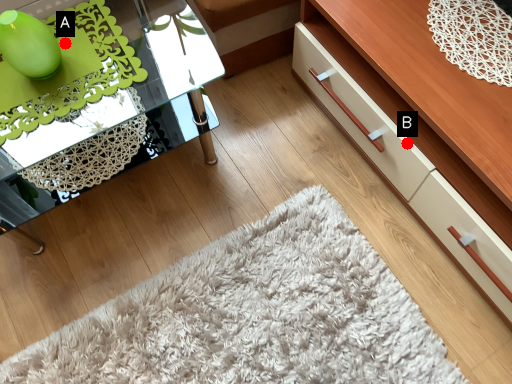
Question: Two points are circled on the image, labeled by A and B beside each circle. Among these points, which one is nearest to the camera?

Choices:
 (A) A is closer
 (B) B is closer

Answer: (A)